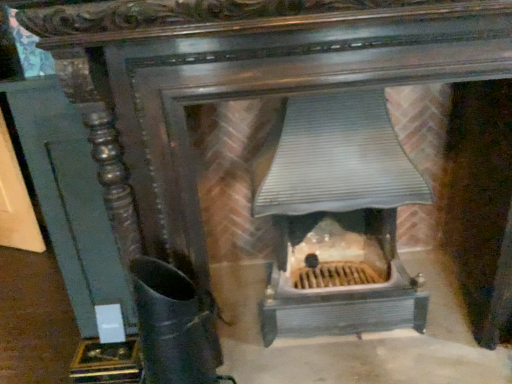
Locate an element on the screen. This screenshot has height=384, width=512. metallic gray heater at center is located at coordinates (339, 220).

Image resolution: width=512 pixels, height=384 pixels. What do you see at coordinates (339, 220) in the screenshot?
I see `metallic gray heater at center` at bounding box center [339, 220].

Describe the element at coordinates (173, 326) in the screenshot. The image size is (512, 384). I see `black matte boot at lower left` at that location.

Measure the distance between point (144, 352) and camera.

Point (144, 352) is 1.06 meters away from camera.

Locate an element on the screen. The width and height of the screenshot is (512, 384). black matte boot at lower left is located at coordinates (173, 326).

At what (x,y) coordinates should I click in order to perform the action: click on metallic gray heater at center. Please return your answer as a coordinate pair (x, y). The height and width of the screenshot is (384, 512). Looking at the image, I should click on (339, 220).

Which is more to the right, metallic gray heater at center or black matte boot at lower left?

metallic gray heater at center is more to the right.

Is metallic gray heater at center in front of black matte boot at lower left?

No, it is behind black matte boot at lower left.

Between point (377, 306) and point (180, 320), which one is positioned in front?

The point (180, 320) is in front.

From the image's perspective, is metallic gray heater at center on black matte boot at lower left?

Indeed, from the image's perspective, metallic gray heater at center is shown above black matte boot at lower left.

From a real-world perspective, is metallic gray heater at center above or below black matte boot at lower left?

From a real-world perspective, metallic gray heater at center is physically above black matte boot at lower left.

Considering the sizes of metallic gray heater at center and black matte boot at lower left in the image, is metallic gray heater at center wider or thinner than black matte boot at lower left?

In the image, metallic gray heater at center appears to be wider than black matte boot at lower left.

Which of these two, metallic gray heater at center or black matte boot at lower left, stands taller?

metallic gray heater at center is taller.

Considering the sizes of objects metallic gray heater at center and black matte boot at lower left in the image provided, who is bigger, metallic gray heater at center or black matte boot at lower left?

Bigger between the two is metallic gray heater at center.

Is metallic gray heater at center inside the boundaries of black matte boot at lower left, or outside?

metallic gray heater at center lies outside black matte boot at lower left.

Is the surface of metallic gray heater at center in direct contact with black matte boot at lower left?

No, metallic gray heater at center is not in contact with black matte boot at lower left.

Is metallic gray heater at center facing away from black matte boot at lower left?

No, metallic gray heater at center is not facing the opposite direction of black matte boot at lower left.

Locate an element on the screen. Image resolution: width=512 pixels, height=384 pixels. heater behind the black matte boot at lower left is located at coordinates (339, 220).

Between black matte boot at lower left and metallic gray heater at center, which one appears on the right side from the viewer's perspective?

Positioned to the right is metallic gray heater at center.

Consider the image. Is black matte boot at lower left further to camera compared to metallic gray heater at center?

No, it is in front of metallic gray heater at center.

Between point (228, 377) and point (414, 290), which one is positioned in front?

The point (228, 377) is in front.

From the image's perspective, does black matte boot at lower left appear higher than metallic gray heater at center?

No, from the image's perspective, black matte boot at lower left is not on top of metallic gray heater at center.

From a real-world perspective, relative to metallic gray heater at center, is black matte boot at lower left vertically above or below?

In terms of real-world spatial position, black matte boot at lower left is below metallic gray heater at center.

Considering the relative sizes of black matte boot at lower left and metallic gray heater at center in the image provided, is black matte boot at lower left thinner than metallic gray heater at center?

Yes, black matte boot at lower left is thinner than metallic gray heater at center.

Is black matte boot at lower left shorter than metallic gray heater at center?

Yes, black matte boot at lower left is shorter than metallic gray heater at center.

Considering the sizes of objects black matte boot at lower left and metallic gray heater at center in the image provided, who is bigger, black matte boot at lower left or metallic gray heater at center?

Bigger between the two is metallic gray heater at center.

Is metallic gray heater at center located within black matte boot at lower left?

Actually, metallic gray heater at center is outside black matte boot at lower left.

Can you see black matte boot at lower left touching metallic gray heater at center?

black matte boot at lower left and metallic gray heater at center are not in contact.

Based on the photo, is black matte boot at lower left turned away from metallic gray heater at center?

black matte boot at lower left is not turned away from metallic gray heater at center.

Where is `heater that is above the black matte boot at lower left (from a real-world perspective)`? heater that is above the black matte boot at lower left (from a real-world perspective) is located at coordinates (339, 220).

This screenshot has height=384, width=512. I want to click on heater above the black matte boot at lower left (from the image's perspective), so click(339, 220).

At what (x,y) coordinates should I click in order to perform the action: click on heater behind the black matte boot at lower left. Please return your answer as a coordinate pair (x, y). The height and width of the screenshot is (384, 512). Looking at the image, I should click on (339, 220).